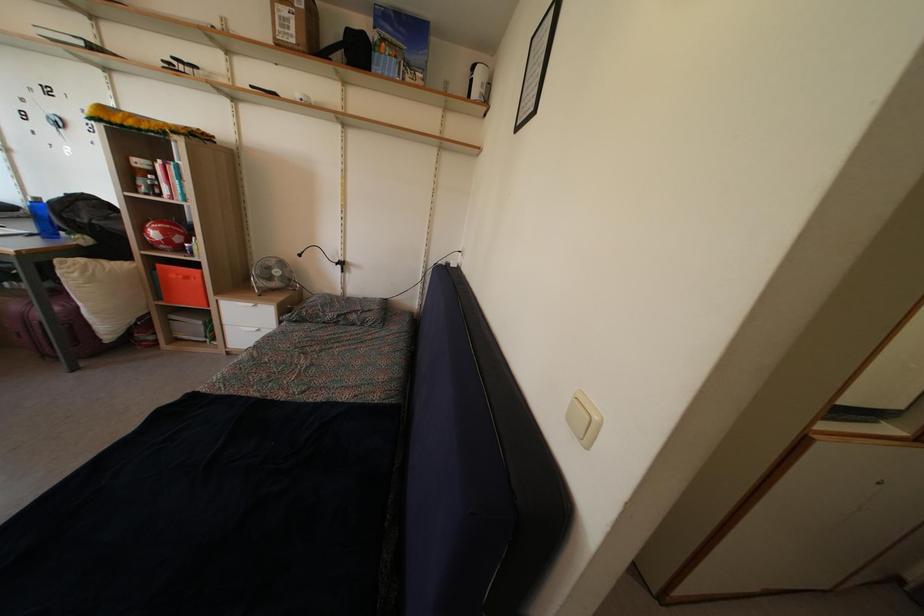
Which object does [339,310] point to?

It refers to a patterned pillow.